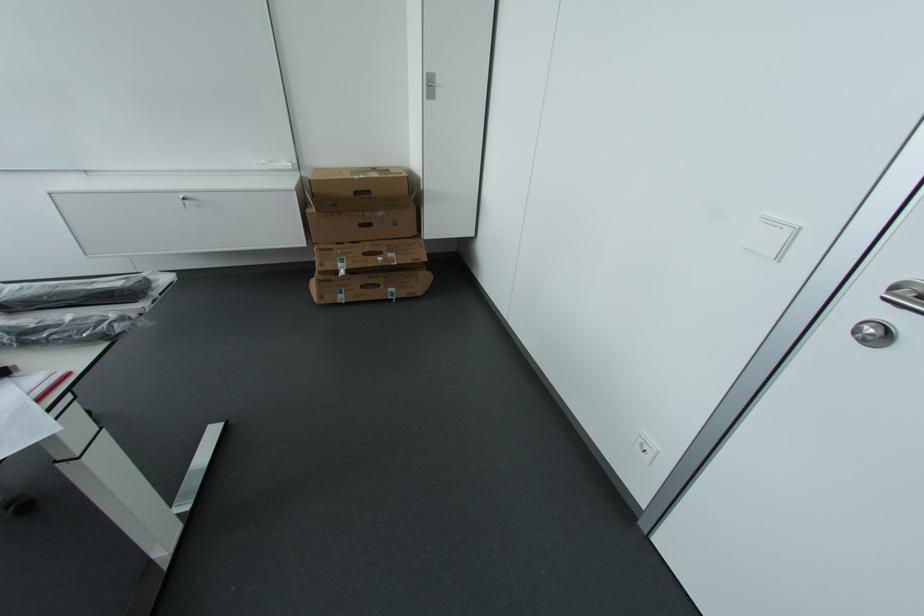
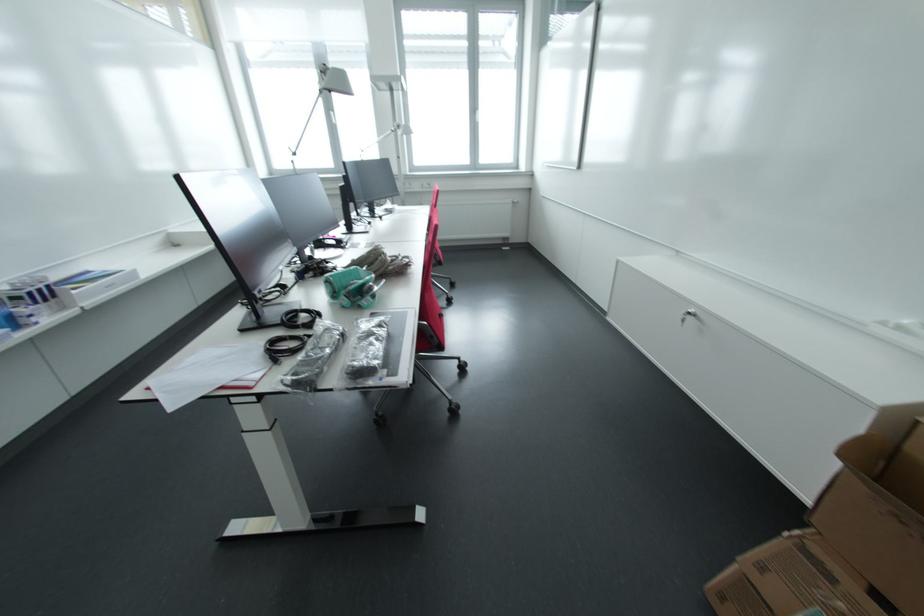
Find the pixel in the second image that matches point (334, 251) in the first image.

(833, 578)